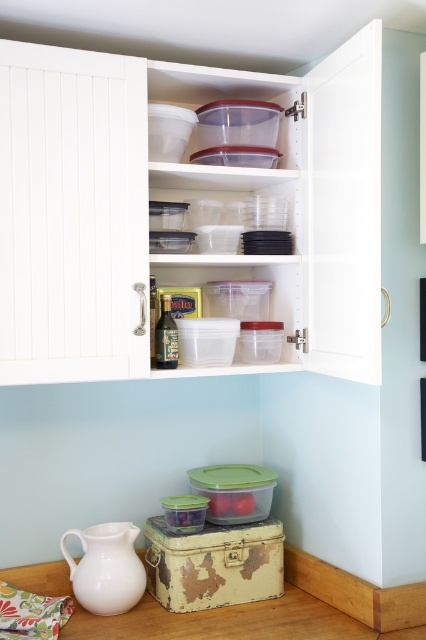
Between clear plastic containers at upper center and white matte jug at lower left, which one is positioned lower?

white matte jug at lower left is lower down.

Where is `clear plastic containers at upper center`? clear plastic containers at upper center is located at coordinates (184, 200).

Does point (17, 125) come behind point (92, 540)?

No.

The height and width of the screenshot is (640, 426). In order to click on clear plastic containers at upper center in this screenshot , I will do `click(184, 200)`.